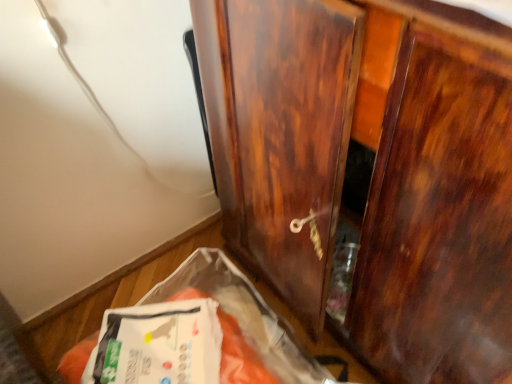
Question: Looking at the image, does glossy wood cupboard at center seem bigger or smaller compared to white plastic bag at lower left?

Choices:
 (A) big
 (B) small

Answer: (A)

Question: From the image's perspective, is glossy wood cupboard at center above or below white plastic bag at lower left?

Choices:
 (A) below
 (B) above

Answer: (B)

Question: Looking at their shapes, would you say glossy wood cupboard at center is wider or thinner than white plastic bag at lower left?

Choices:
 (A) wide
 (B) thin

Answer: (A)

Question: Is white plastic bag at lower left spatially inside glossy wood cupboard at center, or outside of it?

Choices:
 (A) outside
 (B) inside

Answer: (A)

Question: Considering the positions of white plastic bag at lower left and glossy wood cupboard at center in the image, is white plastic bag at lower left wider or thinner than glossy wood cupboard at center?

Choices:
 (A) wide
 (B) thin

Answer: (B)

Question: Does point (151, 344) appear closer or farther from the camera than point (345, 142)?

Choices:
 (A) closer
 (B) farther

Answer: (B)

Question: Is white plastic bag at lower left to the left or to the right of glossy wood cupboard at center in the image?

Choices:
 (A) left
 (B) right

Answer: (A)